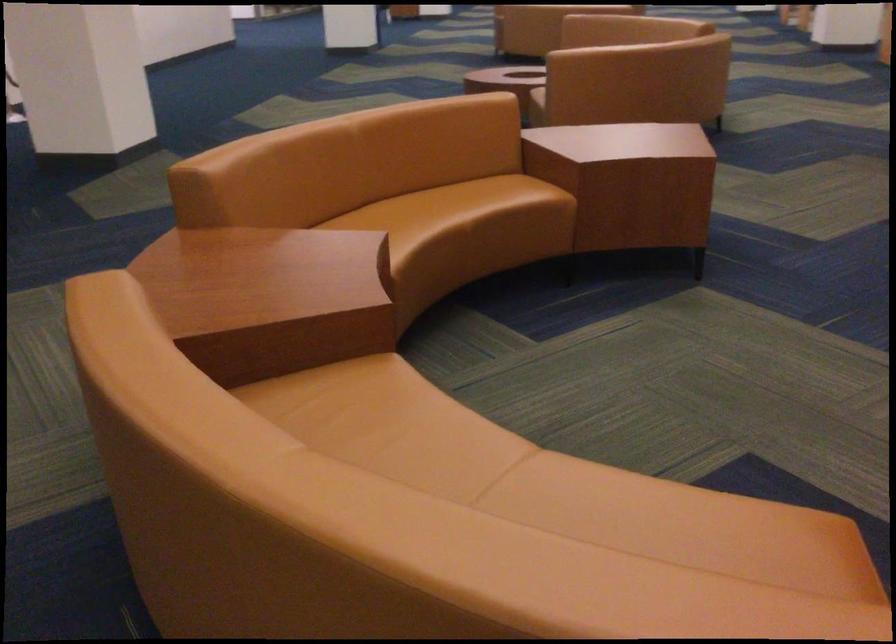
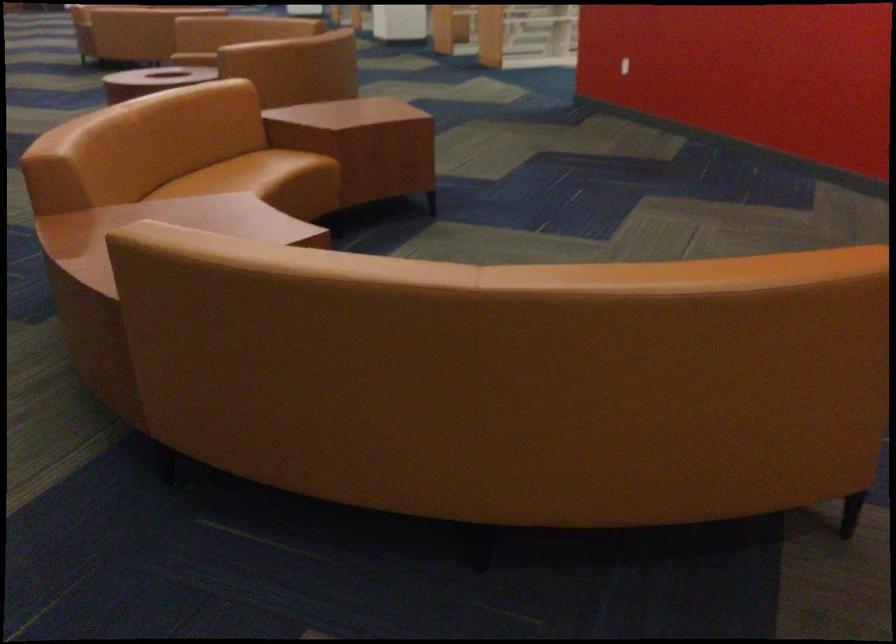
In the second image, find the point that corresponds to point 446,196 in the first image.

(236, 174)